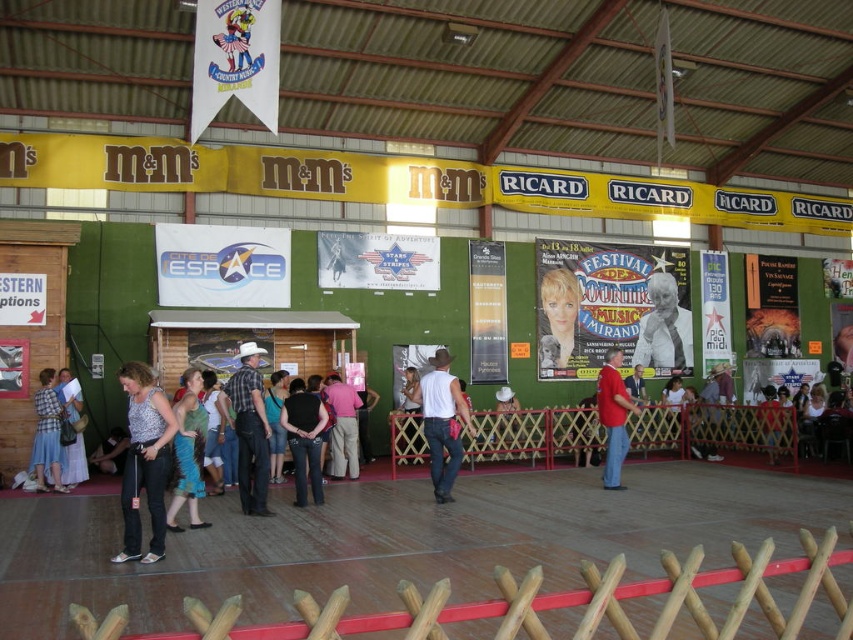
You are attending the Festival de Country Music Mirandais and notice a plaid shirt at center and a white paper poster at center. Which object is closer to you?

The plaid shirt at center is closer to you because it is in front of the white paper poster at center.